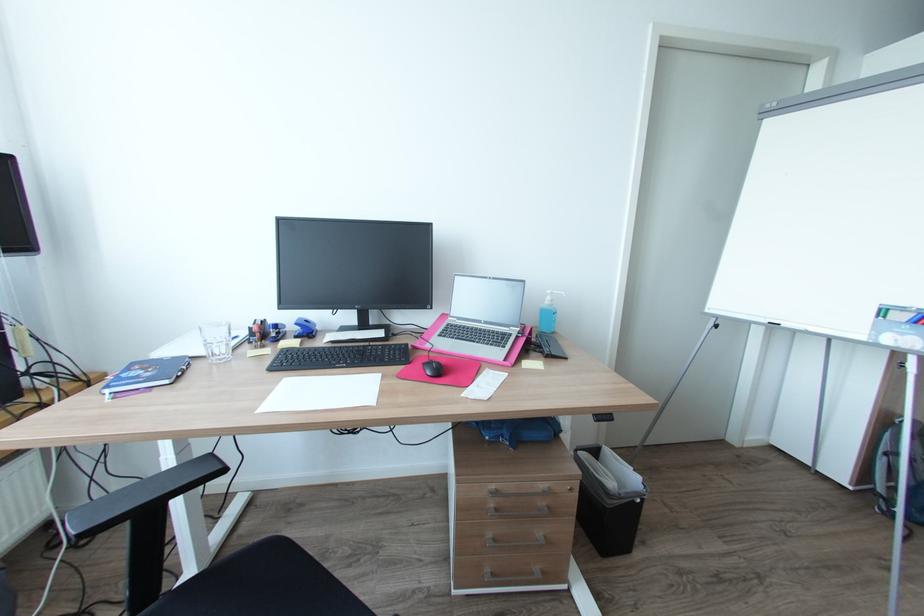
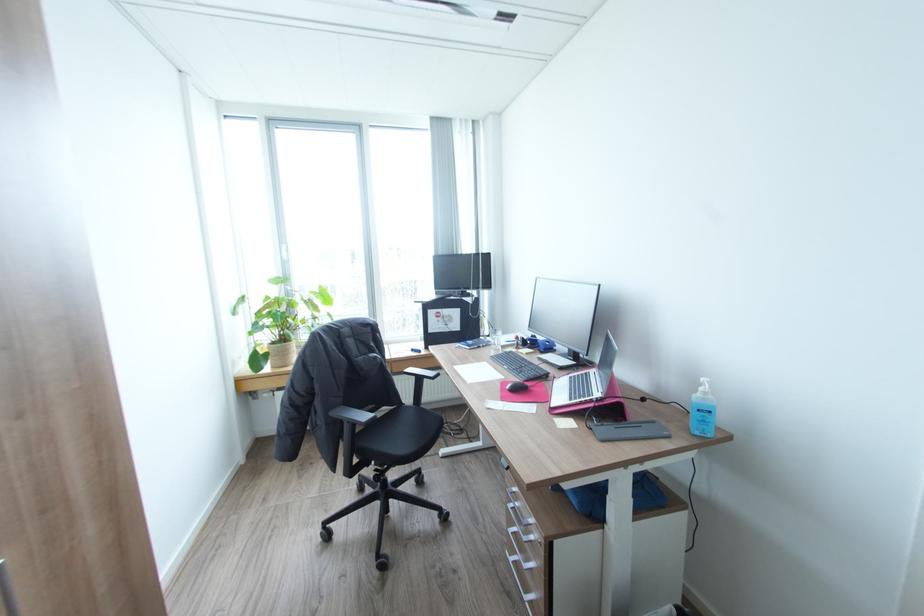
Find the pixel in the second image that matches point 556,300 in the first image.

(710, 392)